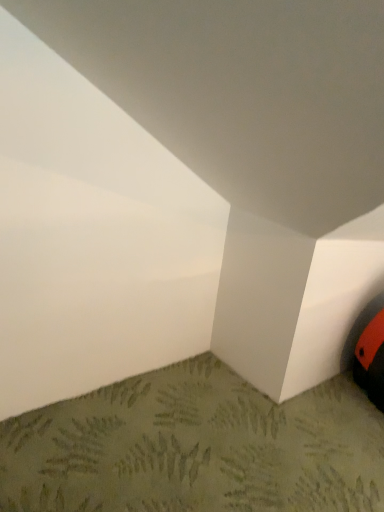
Describe the element at coordinates (196, 447) in the screenshot. I see `black rubber plant at lower right` at that location.

Locate an element on the screen. This screenshot has width=384, height=512. black rubber plant at lower right is located at coordinates (196, 447).

The width and height of the screenshot is (384, 512). I want to click on black rubber plant at lower right, so click(196, 447).